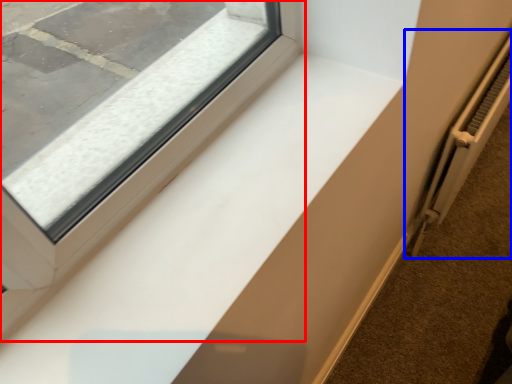
Question: Which object appears farthest to the camera in this image, window (highlighted by a red box) or radiator (highlighted by a blue box)?

Choices:
 (A) window
 (B) radiator

Answer: (B)